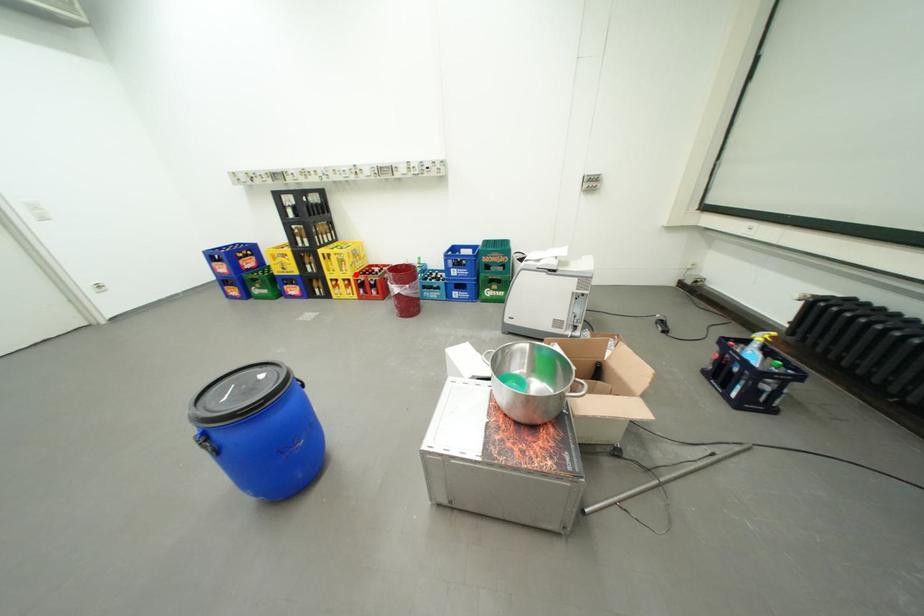
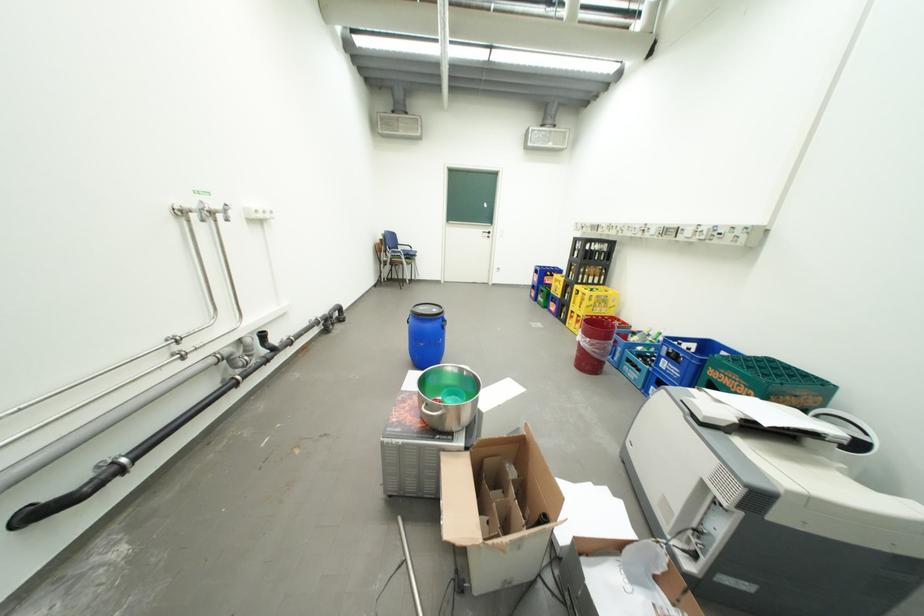
Where in the second image is the point corresponding to the highlighted location from the first image?

(590, 312)